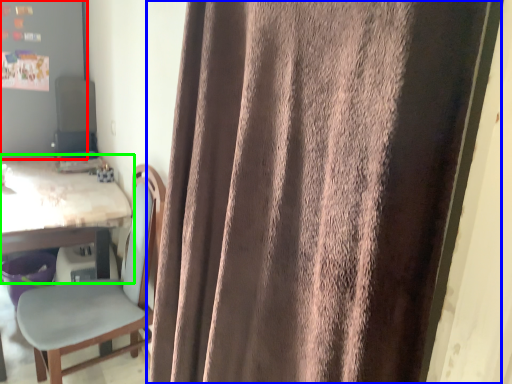
Question: Estimate the real-world distances between objects in this image. Which object is closer to bulletin board (highlighted by a red box), curtain (highlighted by a blue box) or table (highlighted by a green box)?

Choices:
 (A) curtain
 (B) table

Answer: (B)